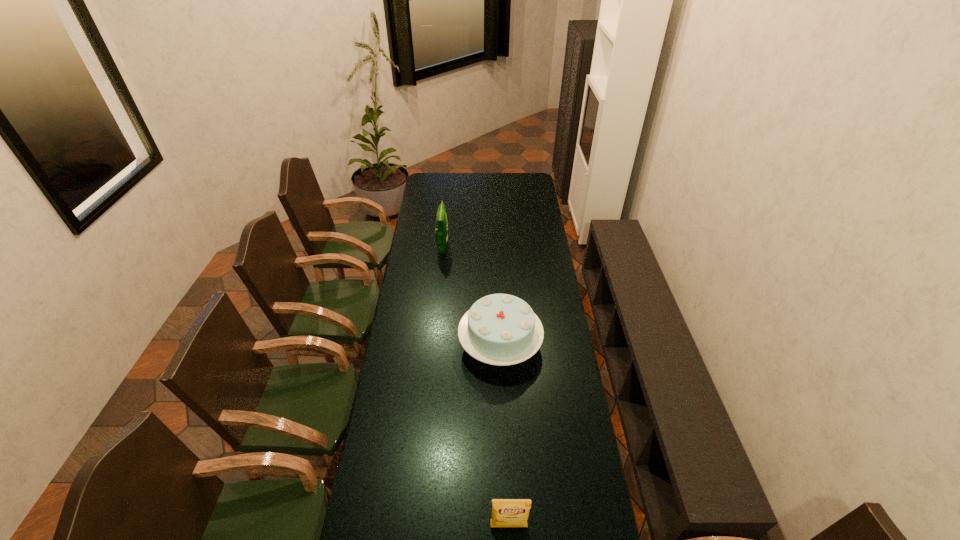
In the image, there is a desktop. Identify the location of blank space at the left edge. The image size is (960, 540). (410, 277).

Where is `vacant region at the right edge of the desktop`? The image size is (960, 540). vacant region at the right edge of the desktop is located at coordinates (559, 288).

In the image, there is a desktop. Where is `vacant space at the far left corner`? vacant space at the far left corner is located at coordinates coord(441,178).

The image size is (960, 540). In order to click on free area in between the taller crisp (potato chip) and the second nearest object in this screenshot , I will do [x=471, y=296].

At what (x,y) coordinates should I click in order to perform the action: click on empty location between the leftmost object and the birthday cake. Please return your answer as a coordinate pair (x, y). This screenshot has width=960, height=540. Looking at the image, I should click on (471, 296).

Where is `free space that is in between the right crisp (potato chip) and the farther crisp (potato chip)`? The height and width of the screenshot is (540, 960). free space that is in between the right crisp (potato chip) and the farther crisp (potato chip) is located at coordinates (476, 387).

Identify the location of free area in between the shorter crisp (potato chip) and the second farthest object. This screenshot has width=960, height=540. (x=505, y=435).

This screenshot has height=540, width=960. I want to click on free space between the farther crisp (potato chip) and the shorter crisp (potato chip), so click(x=476, y=387).

Where is `free area in between the second farthest object and the farther crisp (potato chip)`? free area in between the second farthest object and the farther crisp (potato chip) is located at coordinates click(x=471, y=296).

Identify which object is the second closest to the second nearest object. Please provide its 2D coordinates. Your answer should be formatted as a tuple, i.e. [(x, y)], where the tuple contains the x and y coordinates of a point satisfying the conditions above.

[(506, 512)]